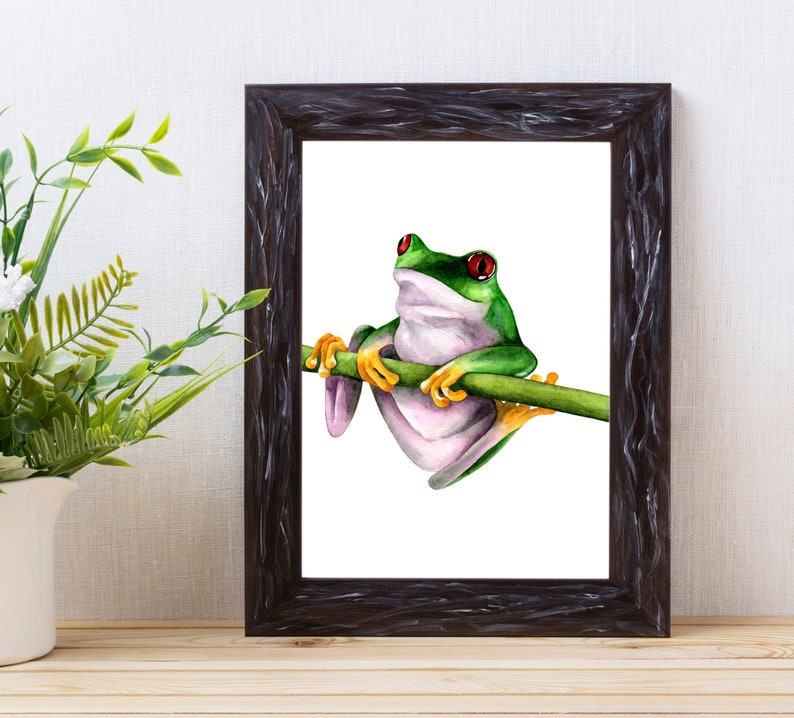
Locate an element on the screen. The width and height of the screenshot is (794, 718). black photo frame is located at coordinates (440, 116).